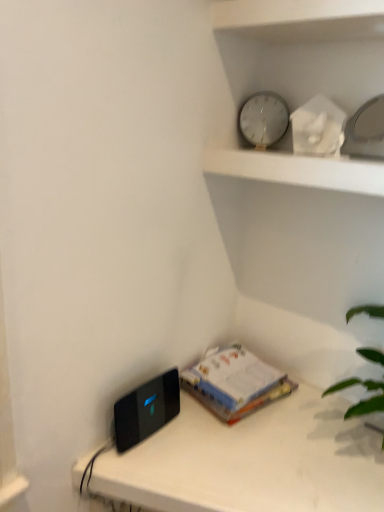
Locate an element on the screen. vacant space that's between black glossy ipod at lower left and white paper at center is located at coordinates (173, 430).